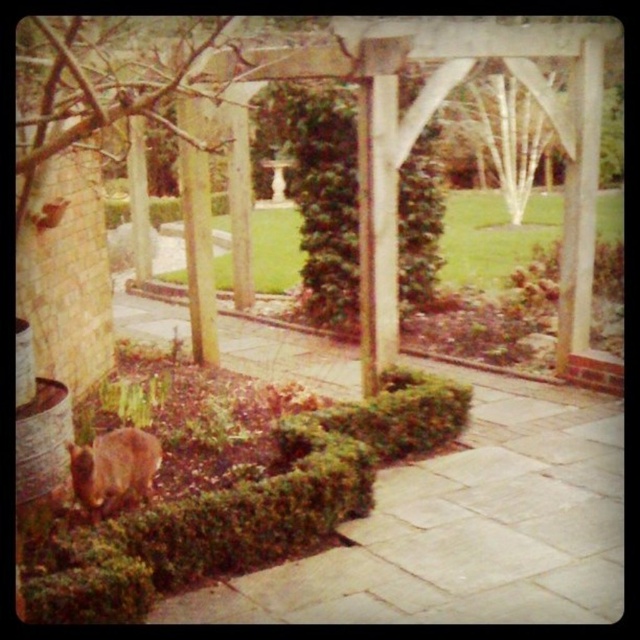
Question: Does green leafy bush at center lie behind brown furry rabbit at lower left?

Choices:
 (A) yes
 (B) no

Answer: (A)

Question: Which point appears closest to the camera in this image?

Choices:
 (A) coord(342,272)
 (B) coord(138,438)

Answer: (B)

Question: Which point is closer to the camera?

Choices:
 (A) green leafy bush at center
 (B) brown furry rabbit at lower left

Answer: (B)

Question: Which point is closer to the camera?

Choices:
 (A) (339, 106)
 (B) (132, 456)

Answer: (B)

Question: Is green leafy bush at center in front of brown furry rabbit at lower left?

Choices:
 (A) no
 (B) yes

Answer: (A)

Question: Is the position of green leafy bush at center less distant than that of brown furry rabbit at lower left?

Choices:
 (A) no
 (B) yes

Answer: (A)